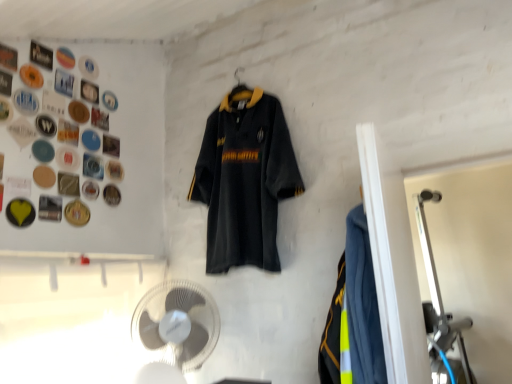
Where is `gold metallic button at upper left, which is the 13th button from top to bottom`? This screenshot has height=384, width=512. gold metallic button at upper left, which is the 13th button from top to bottom is located at coordinates (77, 213).

Describe the element at coordinates (8, 57) in the screenshot. I see `metallic silver button at upper left, placed as the 11th button when sorted from bottom to top` at that location.

This screenshot has height=384, width=512. What are the coordinates of `white plastic button at upper left, placed as the 1th button when sorted from top to bottom` in the screenshot? It's located at (88, 67).

What do you see at coordinates (20, 212) in the screenshot?
I see `yellow matte button at upper left, the 2th button when ordered from bottom to top` at bounding box center [20, 212].

Identify the location of gold metallic button at upper left, which is the 13th button from top to bottom. The image size is (512, 384). (77, 213).

Which is further, (110, 152) or (69, 161)?

The point (110, 152) is more distant.

Is matte plastic button at upper left, which ranks as the tenth button in top-to-bottom order, inside metallic silver button at upper left, which is counted as the 9th button, starting from the top?

No, matte plastic button at upper left, which ranks as the tenth button in top-to-bottom order, is not a part of metallic silver button at upper left, which is counted as the 9th button, starting from the top.

Consider the image. Is metallic silver button at upper left, which is counted as the 9th button, starting from the top, positioned far away from matte plastic button at upper left, positioned as the 4th button in bottom-to-top order?

metallic silver button at upper left, which is counted as the 9th button, starting from the top, is near matte plastic button at upper left, positioned as the 4th button in bottom-to-top order, not far away.

In the image, is metallic silver button at upper left, which is counted as the 9th button, starting from the top, positioned in front of or behind matte plastic button at upper left, positioned as the 4th button in bottom-to-top order?

Clearly, metallic silver button at upper left, which is counted as the 9th button, starting from the top, is behind matte plastic button at upper left, positioned as the 4th button in bottom-to-top order.

Considering their positions, is matte plastic button at upper left, the eighth button ordered from the bottom, located in front of or behind white plastic button at upper left, placed as the 13th button when sorted from bottom to top?

matte plastic button at upper left, the eighth button ordered from the bottom, is positioned farther from the viewer than white plastic button at upper left, placed as the 13th button when sorted from bottom to top.

Does matte plastic button at upper left, the eighth button ordered from the bottom, contain white plastic button at upper left, placed as the 13th button when sorted from bottom to top?

No, white plastic button at upper left, placed as the 13th button when sorted from bottom to top, is not surrounded by matte plastic button at upper left, the eighth button ordered from the bottom.

Does point (102, 101) lie behind point (82, 64)?

That is True.

From a real-world perspective, is matte plastic button at upper left, which ranks as the 6th button in top-to-bottom order, located higher than white plastic button at upper left, placed as the 1th button when sorted from top to bottom?

No, from a real-world perspective, matte plastic button at upper left, which ranks as the 6th button in top-to-bottom order, is not above white plastic button at upper left, placed as the 1th button when sorted from top to bottom.

Measure the distance between white plastic button at upper left, placed as the 1th button when sorted from top to bottom, and dark gray jersey at center.

white plastic button at upper left, placed as the 1th button when sorted from top to bottom, and dark gray jersey at center are 80.05 centimeters apart.

Are white plastic button at upper left, placed as the 13th button when sorted from bottom to top, and dark gray jersey at center far apart?

Actually, white plastic button at upper left, placed as the 13th button when sorted from bottom to top, and dark gray jersey at center are a little close together.

Considering the sizes of objects white plastic button at upper left, placed as the 13th button when sorted from bottom to top, and dark gray jersey at center in the image provided, who is taller, white plastic button at upper left, placed as the 13th button when sorted from bottom to top, or dark gray jersey at center?

Standing taller between the two is dark gray jersey at center.

Does white plastic button at upper left, placed as the 1th button when sorted from top to bottom, have a lesser width compared to dark gray jersey at center?

Yes, white plastic button at upper left, placed as the 1th button when sorted from top to bottom, is thinner than dark gray jersey at center.

From a real-world perspective, relative to metallic silver button at upper left, which ranks as the 10th button in bottom-to-top order, is yellow matte button at upper left, the 2th button when ordered from bottom to top, vertically above or below?

From a real-world perspective, yellow matte button at upper left, the 2th button when ordered from bottom to top, is physically below metallic silver button at upper left, which ranks as the 10th button in bottom-to-top order.

Between yellow matte button at upper left, which is the twelfth button from top to bottom, and metallic silver button at upper left, which ranks as the 10th button in bottom-to-top order, which one appears on the right side from the viewer's perspective?

metallic silver button at upper left, which ranks as the 10th button in bottom-to-top order.

Can you confirm if yellow matte button at upper left, the 2th button when ordered from bottom to top, is wider than metallic silver button at upper left, which ranks as the 10th button in bottom-to-top order?

Indeed, yellow matte button at upper left, the 2th button when ordered from bottom to top, has a greater width compared to metallic silver button at upper left, which ranks as the 10th button in bottom-to-top order.

Considering the positions of point (12, 223) and point (56, 81), is point (12, 223) closer or farther from the camera than point (56, 81)?

Point (12, 223).

Which of these two, matte black button at upper left, the 5th button positioned from the top, or matte black button at upper left, the 6th button from the bottom, stands taller?

matte black button at upper left, the 5th button positioned from the top.

Is matte black button at upper left, the 5th button positioned from the top, beside matte black button at upper left, the 6th button from the bottom?

matte black button at upper left, the 5th button positioned from the top, and matte black button at upper left, the 6th button from the bottom, are clearly separated.

Locate an element on the screen. The width and height of the screenshot is (512, 384). the 6th button in front when counting from the matte black button at upper left, the 5th button positioned from the top is located at coordinates (46, 125).

Considering the relative sizes of metallic gold button at upper left, which ranks as the third button in bottom-to-top order, and metallic silver button at upper left, placed as the 11th button when sorted from bottom to top, in the image provided, is metallic gold button at upper left, which ranks as the third button in bottom-to-top order, wider than metallic silver button at upper left, placed as the 11th button when sorted from bottom to top,?

No, metallic gold button at upper left, which ranks as the third button in bottom-to-top order, is not wider than metallic silver button at upper left, placed as the 11th button when sorted from bottom to top.

This screenshot has height=384, width=512. I want to click on the 8th button above the metallic gold button at upper left, which ranks as the third button in bottom-to-top order (from the image's perspective), so click(8, 57).

Considering the sizes of metallic gold button at upper left, marked as the 11th button in a top-to-bottom arrangement, and metallic silver button at upper left, placed as the 11th button when sorted from bottom to top, in the image, is metallic gold button at upper left, marked as the 11th button in a top-to-bottom arrangement, taller or shorter than metallic silver button at upper left, placed as the 11th button when sorted from bottom to top,?

Considering their sizes, metallic gold button at upper left, marked as the 11th button in a top-to-bottom arrangement, has more height than metallic silver button at upper left, placed as the 11th button when sorted from bottom to top.

Which is behind, metallic gold button at upper left, which ranks as the third button in bottom-to-top order, or metallic silver button at upper left, arranged as the third button when viewed from the top?

metallic gold button at upper left, which ranks as the third button in bottom-to-top order, is further from the camera.

Is gold metallic button at upper left, the first button positioned from the bottom, oriented towards dark gray jersey at center?

No, gold metallic button at upper left, the first button positioned from the bottom, is not turned towards dark gray jersey at center.

Relative to dark gray jersey at center, is gold metallic button at upper left, which is the 13th button from top to bottom, in front or behind?

Clearly, gold metallic button at upper left, which is the 13th button from top to bottom, is behind dark gray jersey at center.

Is gold metallic button at upper left, the first button positioned from the bottom, at the right side of dark gray jersey at center?

No.

Would you say dark gray jersey at center is part of gold metallic button at upper left, the first button positioned from the bottom,'s contents?

That's incorrect, dark gray jersey at center is not inside gold metallic button at upper left, the first button positioned from the bottom.

From a real-world perspective, which button is the 1st one underneath the metallic silver button at upper left, which appears as the 5th button when ordered from the bottom? Please provide its 2D coordinates.

[(67, 158)]

You are a GUI agent. You are given a task and a screenshot of the screen. Output one action in this format:
    pyautogui.click(x=<x>, y=<y>)
    Task: Click on the button that is the 2nd object located behind the white plastic button at upper left, placed as the 13th button when sorted from bottom to top
    The width and height of the screenshot is (512, 384).
    Given the screenshot: What is the action you would take?
    pyautogui.click(x=110, y=100)

Considering their positions, is metallic silver button at upper left, which is counted as the 9th button, starting from the top, positioned further to metallic silver button at upper left, marked as the 4th button in a top-to-bottom arrangement, than matte plastic button at upper left, positioned as the 4th button in bottom-to-top order?

matte plastic button at upper left, positioned as the 4th button in bottom-to-top order, is further to metallic silver button at upper left, marked as the 4th button in a top-to-bottom arrangement.

Based on their spatial positions, is metallic button at upper left, marked as the twelfth button in a bottom-to-top arrangement, or dark gray jersey at center closer to gold metallic button at upper left, which is the 13th button from top to bottom?

The object closer to gold metallic button at upper left, which is the 13th button from top to bottom, is metallic button at upper left, marked as the twelfth button in a bottom-to-top arrangement.

Which object lies further to the anchor point matte plastic button at upper left, which ranks as the 6th button in top-to-bottom order, yellow matte button at upper left, which is the twelfth button from top to bottom, or matte black button at upper left, positioned as the 8th button in top-to-bottom order?

yellow matte button at upper left, which is the twelfth button from top to bottom, is further to matte plastic button at upper left, which ranks as the 6th button in top-to-bottom order.

Which object lies nearer to the anchor point metallic silver button at upper left, which appears as the 5th button when ordered from the bottom, metallic gold button at upper left, which ranks as the third button in bottom-to-top order, or metallic button at upper left, which is the second button in top-to-bottom order?

metallic gold button at upper left, which ranks as the third button in bottom-to-top order, lies closer to metallic silver button at upper left, which appears as the 5th button when ordered from the bottom, than the other object.

When comparing their distances from metallic silver button at upper left, which ranks as the 10th button in bottom-to-top order, does matte plastic button at upper left, which ranks as the tenth button in top-to-bottom order, or white plastic fan at lower center seem closer?

matte plastic button at upper left, which ranks as the tenth button in top-to-bottom order.

From the picture: From the image, which object appears to be nearer to metallic button at upper left, which is the second button in top-to-bottom order, matte plastic button at upper left, the eighth button ordered from the bottom, or white plastic fan at lower center?

matte plastic button at upper left, the eighth button ordered from the bottom.

Which object lies nearer to the anchor point metallic silver button at upper left, arranged as the third button when viewed from the top, matte plastic button at upper left, the eighth button ordered from the bottom, or white plastic button at upper left, placed as the 1th button when sorted from top to bottom?

Based on the image, white plastic button at upper left, placed as the 1th button when sorted from top to bottom, appears to be nearer to metallic silver button at upper left, arranged as the third button when viewed from the top.

From the image, which object appears to be farther from metallic silver button at upper left, which is counted as the 9th button, starting from the top, neon yellow reflective vest at right or metallic button at upper left, which is the second button in top-to-bottom order?

neon yellow reflective vest at right.

You are a GUI agent. You are given a task and a screenshot of the screen. Output one action in this format:
    pyautogui.click(x=<x>, y=<y>)
    Task: Click on the sports uniform between neon yellow reflective vest at right and matte plastic button at upper left, the eighth button ordered from the bottom, in the front-back direction
    Image resolution: width=512 pixels, height=384 pixels.
    Given the screenshot: What is the action you would take?
    pyautogui.click(x=244, y=179)

This screenshot has width=512, height=384. Find the location of `sports uniform between metallic silver button at upper left, which appears as the 5th button when ordered from the bottom, and white plastic fan at lower center from top to bottom`. sports uniform between metallic silver button at upper left, which appears as the 5th button when ordered from the bottom, and white plastic fan at lower center from top to bottom is located at coordinates (244, 179).

Locate an element on the screen. This screenshot has width=512, height=384. sports uniform situated between metallic silver button at upper left, arranged as the third button when viewed from the top, and neon yellow reflective vest at right from left to right is located at coordinates (244, 179).

Where is `sports uniform between yellow matte button at upper left, which is the twelfth button from top to bottom, and neon yellow reflective vest at right from left to right`? The height and width of the screenshot is (384, 512). sports uniform between yellow matte button at upper left, which is the twelfth button from top to bottom, and neon yellow reflective vest at right from left to right is located at coordinates (244, 179).